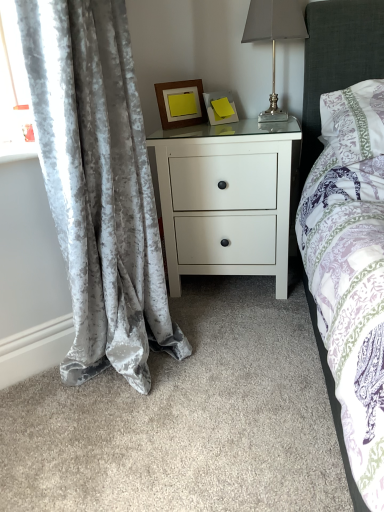
Where is `empty space that is to the right of matte yellow picture frame at upper center, placed as the 1th picture frame when sorted from right to left`? empty space that is to the right of matte yellow picture frame at upper center, placed as the 1th picture frame when sorted from right to left is located at coordinates (254, 122).